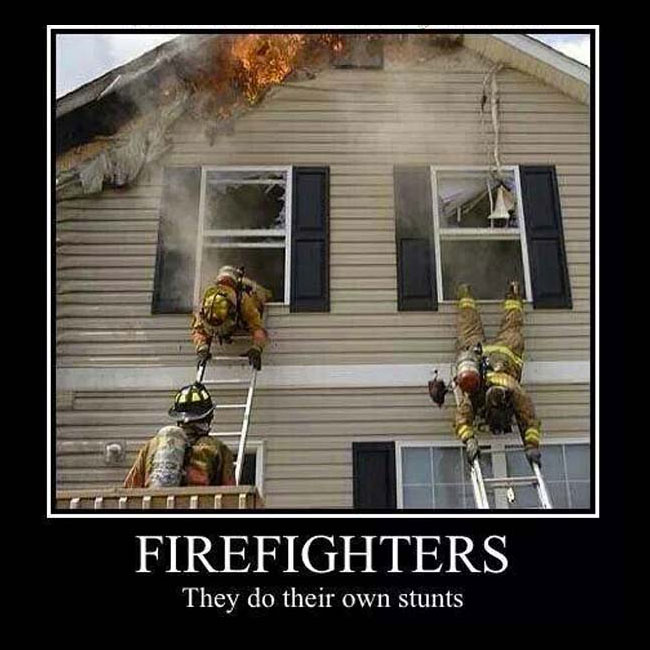
Where is `ladder`? Image resolution: width=650 pixels, height=650 pixels. ladder is located at coordinates coord(246,415), coord(485,489).